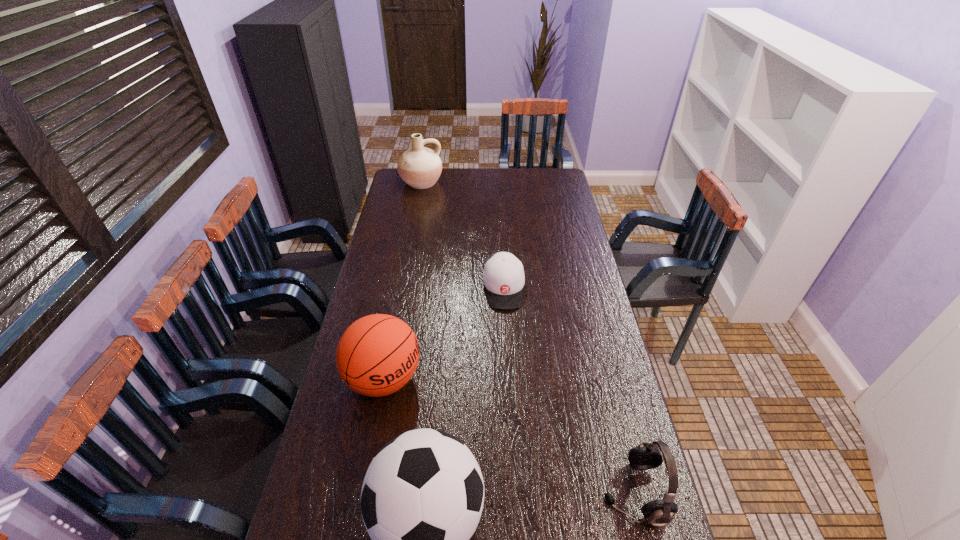
Image resolution: width=960 pixels, height=540 pixels. I want to click on basketball that is at the left edge, so click(x=377, y=355).

In order to click on pottery that is at the left edge in this screenshot , I will do `click(420, 167)`.

The width and height of the screenshot is (960, 540). I want to click on object located in the right edge section of the desktop, so click(646, 456).

Where is `object that is at the far left corner`? object that is at the far left corner is located at coordinates (420, 167).

At what (x,y) coordinates should I click in order to perform the action: click on object that is at the near right corner. Please return your answer as a coordinate pair (x, y). This screenshot has height=540, width=960. Looking at the image, I should click on (646, 456).

At what (x,y) coordinates should I click in order to perform the action: click on free space at the far edge of the desktop. Please return your answer as a coordinate pair (x, y). The image size is (960, 540). Looking at the image, I should click on (528, 188).

Locate an element on the screen. vacant space at the near edge is located at coordinates (581, 507).

The width and height of the screenshot is (960, 540). I want to click on free spot at the left edge of the desktop, so click(x=389, y=203).

In the image, there is a desktop. Where is `vacant area at the right edge`? vacant area at the right edge is located at coordinates (610, 400).

Where is `blank space at the far left corner of the desktop`? The image size is (960, 540). blank space at the far left corner of the desktop is located at coordinates (402, 183).